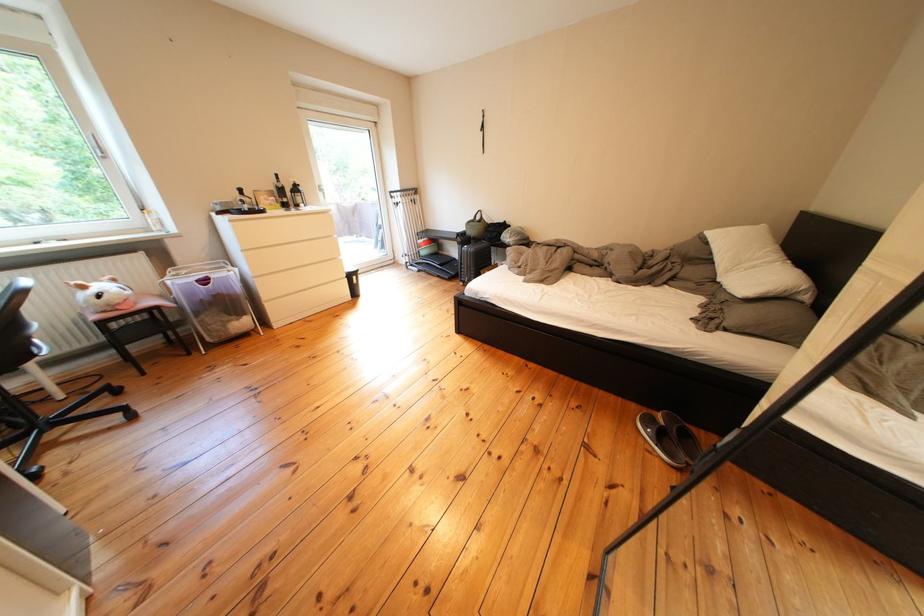
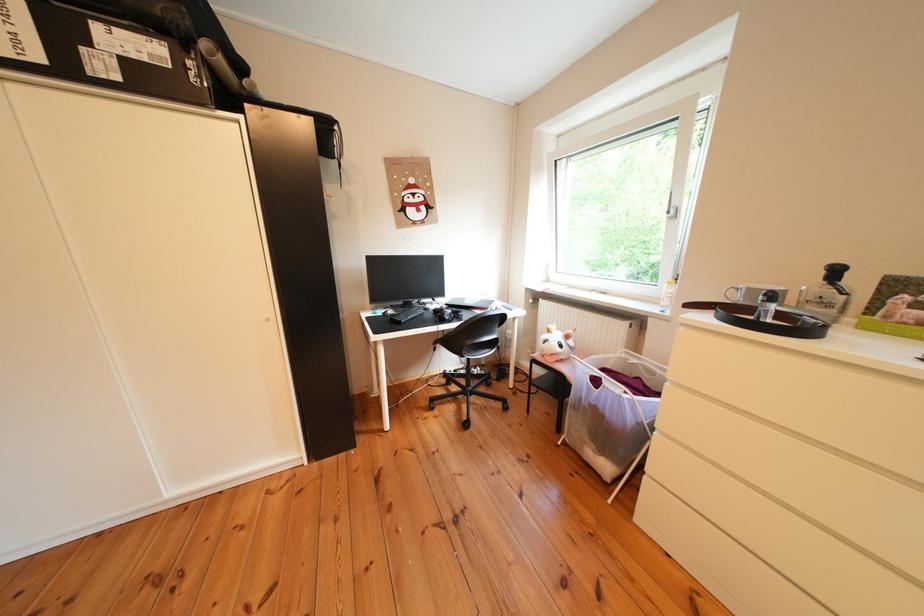
Find the pixel in the second image that matches pixel 240 323 in the first image.

(601, 442)